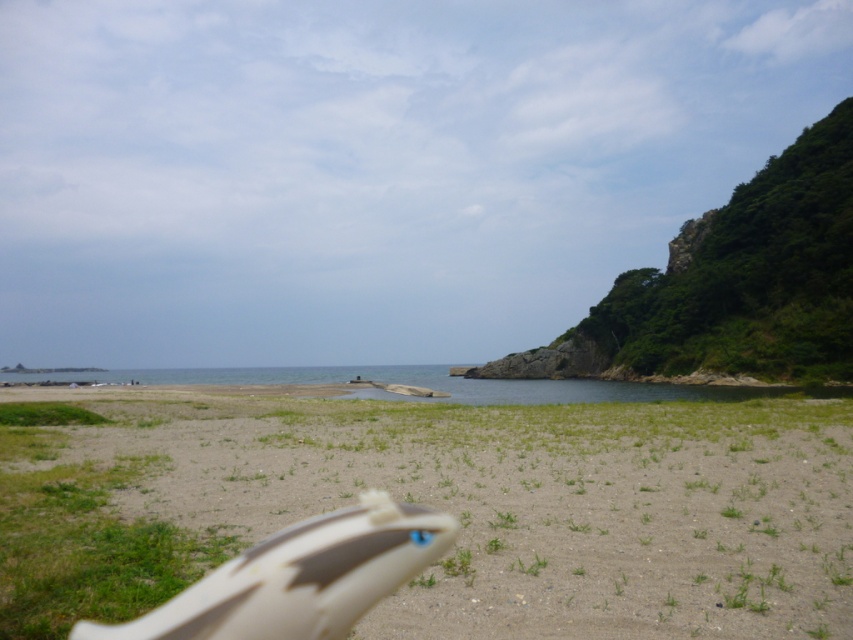
You are standing on the sandy beige at lower center and want to reach the clear blue water at center. Which direction should you move to get there?

You should move towards the clear blue water at center because it is taller than the sandy beige at lower center, so moving towards it would lead you to the water.